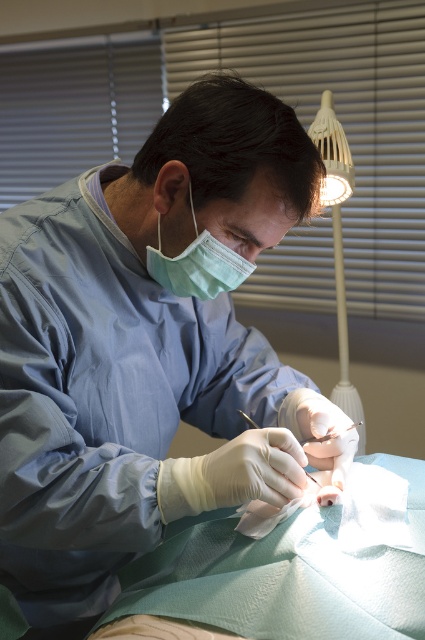
Does matte blue gown at center appear on the right side of white plastic lamp at upper right?

In fact, matte blue gown at center is to the left of white plastic lamp at upper right.

Between point (207, 83) and point (345, 346), which one is positioned in front?

Point (207, 83)

Image resolution: width=425 pixels, height=640 pixels. What do you see at coordinates (149, 349) in the screenshot? I see `matte blue gown at center` at bounding box center [149, 349].

In order to click on matte blue gown at center in this screenshot , I will do `click(149, 349)`.

Between point (226, 97) and point (226, 248), which one is positioned behind?

The point (226, 248) is more distant.

This screenshot has width=425, height=640. What are the coordinates of `matte blue gown at center` in the screenshot? It's located at (149, 349).

Between white plastic lamp at upper right and green matte mask at center, which one is positioned lower?

white plastic lamp at upper right is lower down.

Between point (343, 332) and point (189, 266), which one is positioned in front?

Point (189, 266)

Is point (340, 276) farther from camera compared to point (204, 276)?

Yes.

Locate an element on the screen. white plastic lamp at upper right is located at coordinates (337, 241).